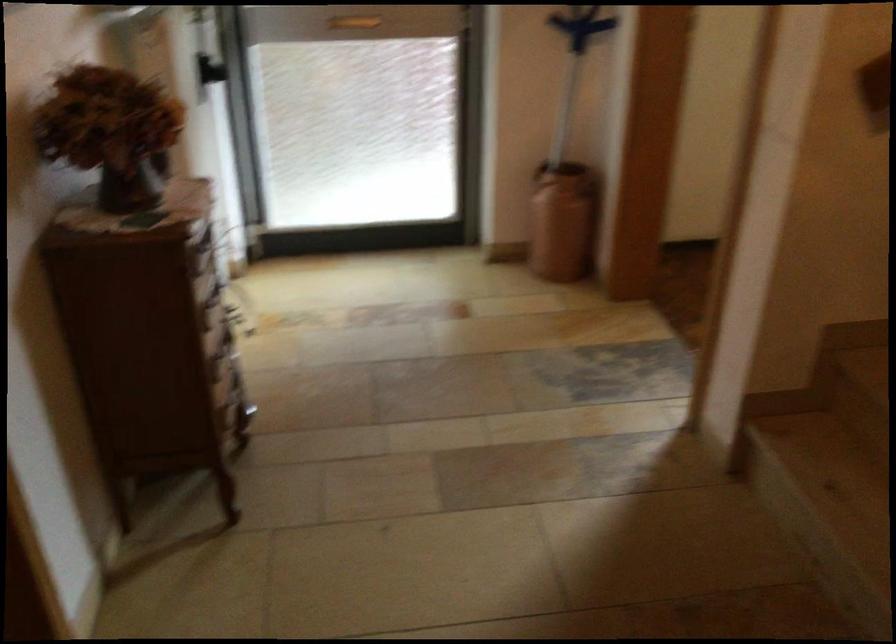
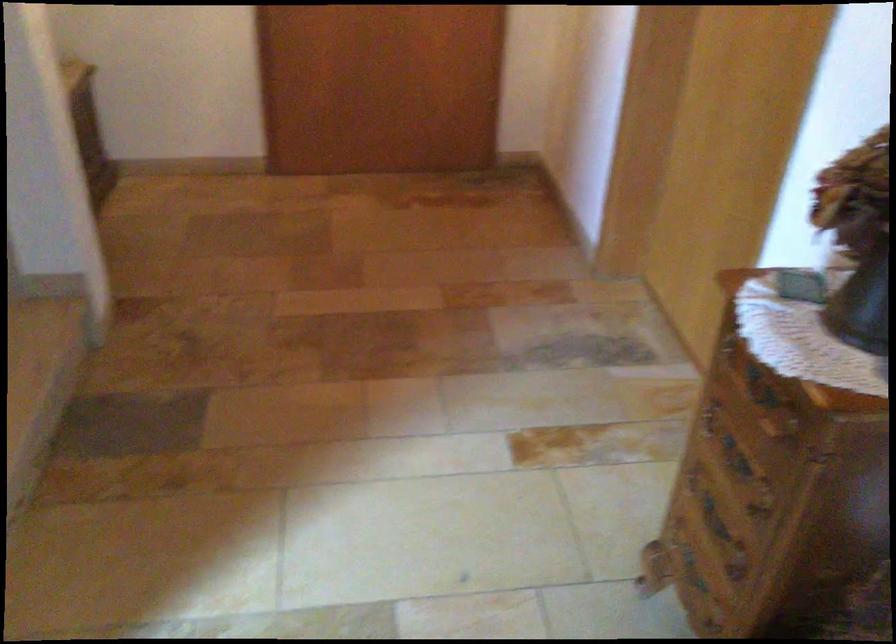
In the second image, find the point that corresponds to [133,220] in the first image.

(863, 303)